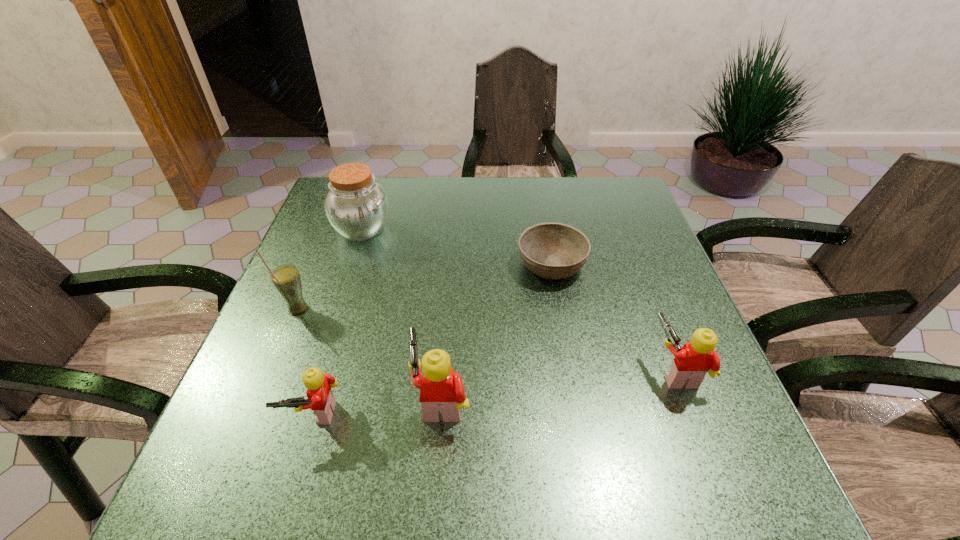
The width and height of the screenshot is (960, 540). Find the location of `vacant space at the near left corner of the desktop`. vacant space at the near left corner of the desktop is located at coordinates (212, 441).

This screenshot has width=960, height=540. I want to click on free space at the far right corner, so click(x=600, y=216).

Locate an element on the screen. This screenshot has width=960, height=540. blank region between the shortest Lego and the jar is located at coordinates (338, 322).

Find the location of a particular element. vacant space that is in between the third shortest object and the jar is located at coordinates (519, 300).

The image size is (960, 540). Find the location of `free spot between the fourth tallest object and the third object from right to left`. free spot between the fourth tallest object and the third object from right to left is located at coordinates (559, 384).

Where is `free point between the third farthest object and the jar`? The height and width of the screenshot is (540, 960). free point between the third farthest object and the jar is located at coordinates (330, 269).

Locate an element on the screen. The width and height of the screenshot is (960, 540). free space between the fourth nearest object and the rightmost object is located at coordinates (487, 340).

The width and height of the screenshot is (960, 540). In order to click on vacant space that's between the straw for drinking and the third shortest object in this screenshot , I will do `click(487, 340)`.

The image size is (960, 540). Find the location of `free space between the shortest Lego and the jar`. free space between the shortest Lego and the jar is located at coordinates (338, 322).

Image resolution: width=960 pixels, height=540 pixels. Identify the location of vacant area that lies between the leftmost Lego and the bowl. (433, 339).